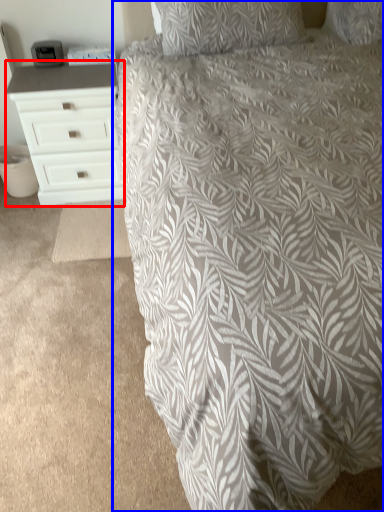
Question: Which object is closer to the camera taking this photo, chest of drawers (highlighted by a red box) or bed (highlighted by a blue box)?

Choices:
 (A) chest of drawers
 (B) bed

Answer: (B)